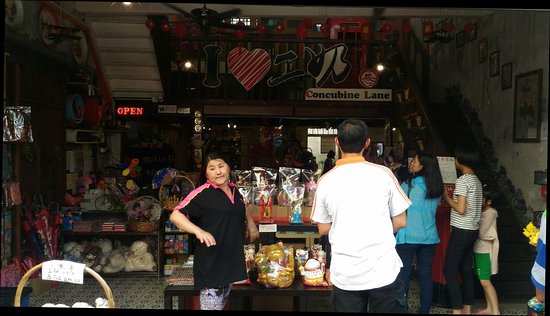
I want to click on basket handle, so click(x=104, y=287).